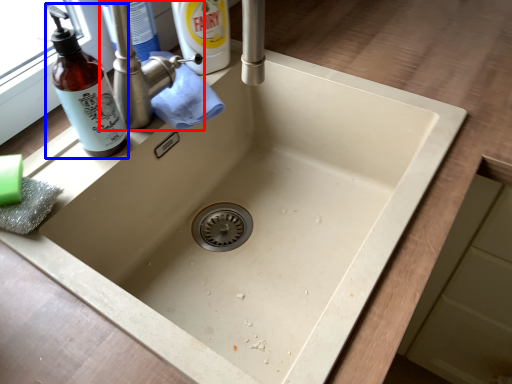
Question: Which of the following is the farthest to the observer, tap (highlighted by a red box) or bottle (highlighted by a blue box)?

Choices:
 (A) tap
 (B) bottle

Answer: (A)